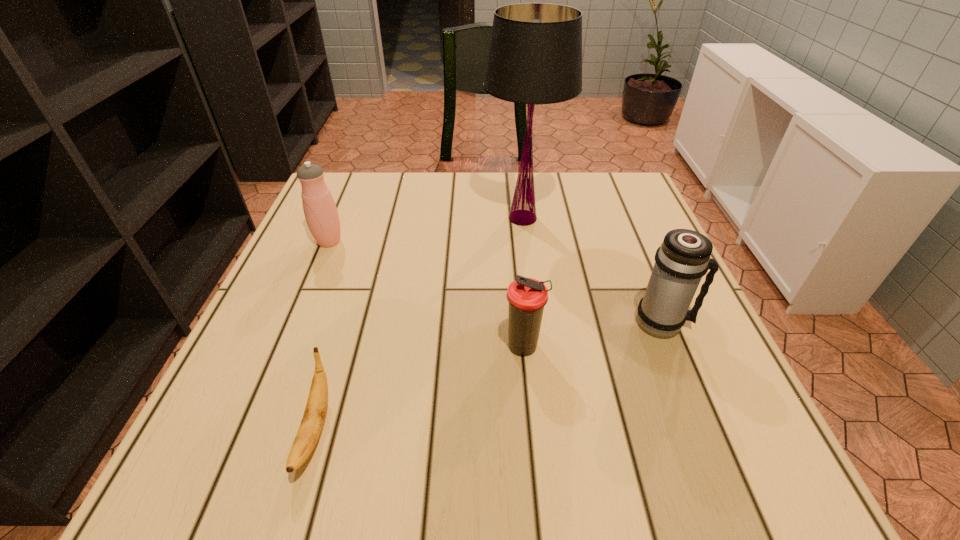
At what (x,y) coordinates should I click in order to perform the action: click on free space at the near edge. Please return your answer as a coordinate pair (x, y). Image resolution: width=960 pixels, height=540 pixels. Looking at the image, I should click on (425, 489).

Where is `vacant space at the left edge of the desktop`? vacant space at the left edge of the desktop is located at coordinates (283, 280).

Where is `vacant space at the right edge of the desktop`? vacant space at the right edge of the desktop is located at coordinates (678, 422).

Image resolution: width=960 pixels, height=540 pixels. I want to click on free region at the near left corner of the desktop, so click(x=203, y=492).

Locate an element on the screen. The width and height of the screenshot is (960, 540). blank space at the far right corner of the desktop is located at coordinates (588, 215).

What are the coordinates of `free space between the leftmost thermos bottle and the rightmost object` in the screenshot? It's located at (495, 282).

At what (x,y) coordinates should I click in order to perform the action: click on free space that is in between the second thermos bottle from right to left and the nearest object. Please return your answer as a coordinate pair (x, y). Looking at the image, I should click on (420, 389).

Identify the location of vacant area that lies between the rightmost object and the fourth tallest object. Image resolution: width=960 pixels, height=540 pixels. (593, 335).

The height and width of the screenshot is (540, 960). What are the coordinates of `vacant region between the lampshade and the banana` in the screenshot? It's located at (419, 324).

You are a GUI agent. You are given a task and a screenshot of the screen. Output one action in this format:
    pyautogui.click(x=<x>, y=<y>)
    Task: Click on the vacant space in between the shortest object and the lampshade
    This screenshot has height=540, width=960.
    Given the screenshot: What is the action you would take?
    pyautogui.click(x=419, y=324)